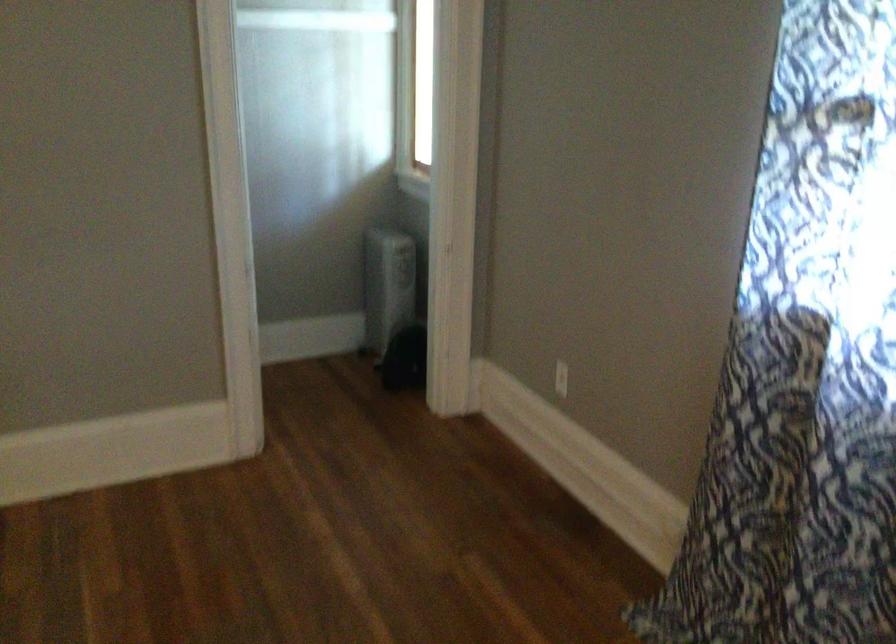
The image size is (896, 644). I want to click on electrical outlet, so click(561, 379).